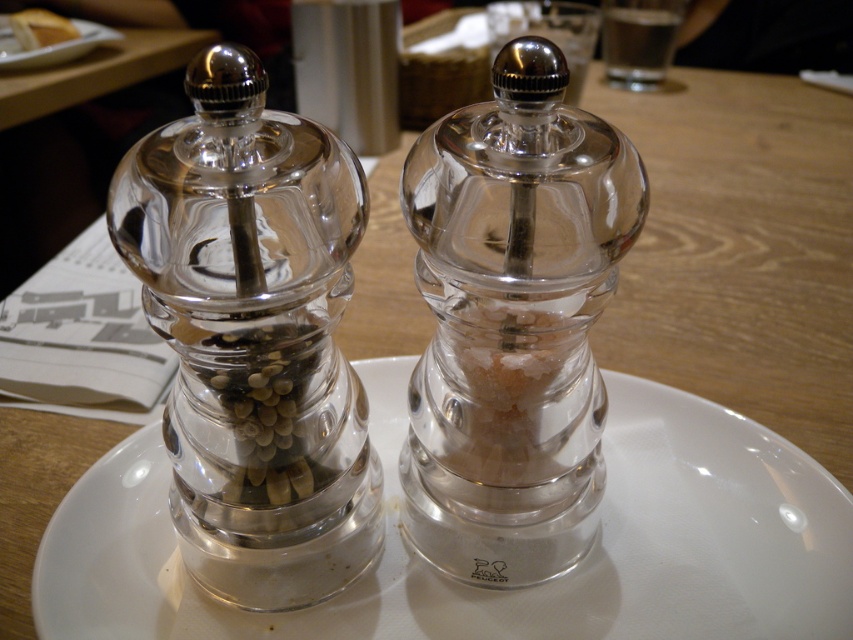
You are a chef preparing a dish and need to place a garnish on the white glossy plate at upper left. To ensure accuracy, what are the coordinates where you should place it?

The white glossy plate at upper left is located at coordinates point (x=51, y=45), so you should place the garnish there.

You are a restaurant server who needs to place a 12 cm long spoon between the clear glass pepper grinder at left and the transparent glass salt shaker at center. Can the spoon fit between them without touching either?

The clear glass pepper grinder at left is 10.88 centimeters away from the transparent glass salt shaker at center. Since the spoon is 12 cm long, it cannot fit between them without overlapping or touching either object.

You are a chef preparing a dish and need to season the bread. You see the transparent glass salt shaker at center and the matte white bread at upper left. Which direction should you move to reach the salt shaker first?

The transparent glass salt shaker at center is to the right of the matte white bread at upper left, so you should move to the right to reach the salt shaker first.